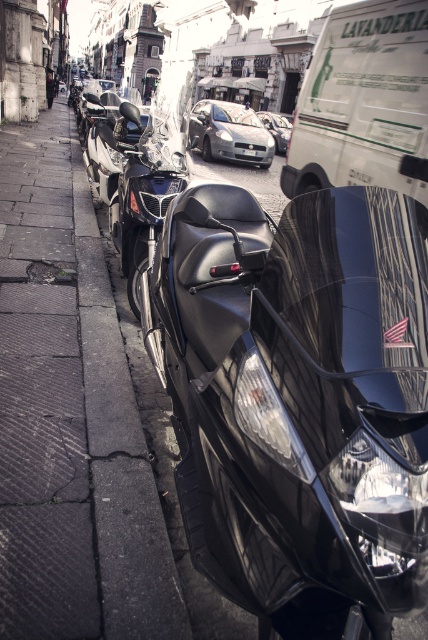
You are a parking attendant trying to fit a new vehicle into the space between the satin silver car at center and the white plastic license plate at center. The new vehicle is 1.2 meters wide. Can it fit in the space between them?

The satin silver car at center is wider than the white plastic license plate at center. However, the exact width difference isn not specified, so it is unclear if the 1.2 meter wide vehicle can fit between them.

You are a delivery person who needs to place a small package on the ground. You have two options in the image provided. Which object, dark concrete pavement at left or white plastic license plate at center, is more suitable for placing the package?

The dark concrete pavement at left is more suitable for placing the package because it has a larger size compared to the white plastic license plate at center, providing enough space for the package.

You are a delivery person who needs to park your vehicle in this area. You have a large delivery van that requires a parking space wider than the glossy black motorcycle at center. Can you determine if the shiny silver sports car at center will provide enough space for your van?

The glossy black motorcycle at center is larger in size than the shiny silver sports car at center, so the space where the shiny silver sports car at center is parked may not be wide enough for your delivery van since the motorcycle is larger and the car is smaller.